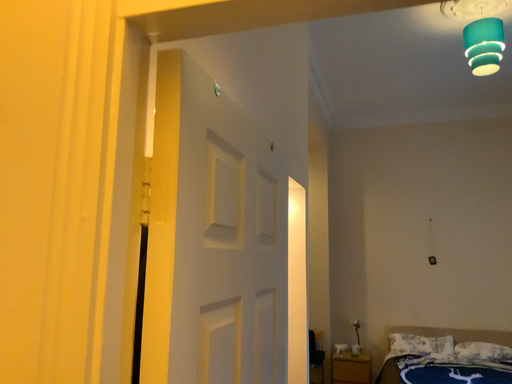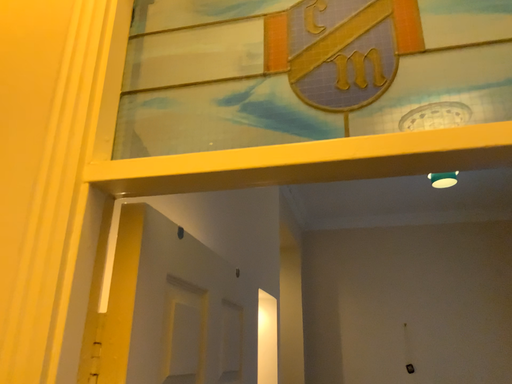
Question: Which way did the camera rotate in the video?

Choices:
 (A) rotated downward
 (B) rotated upward

Answer: (B)